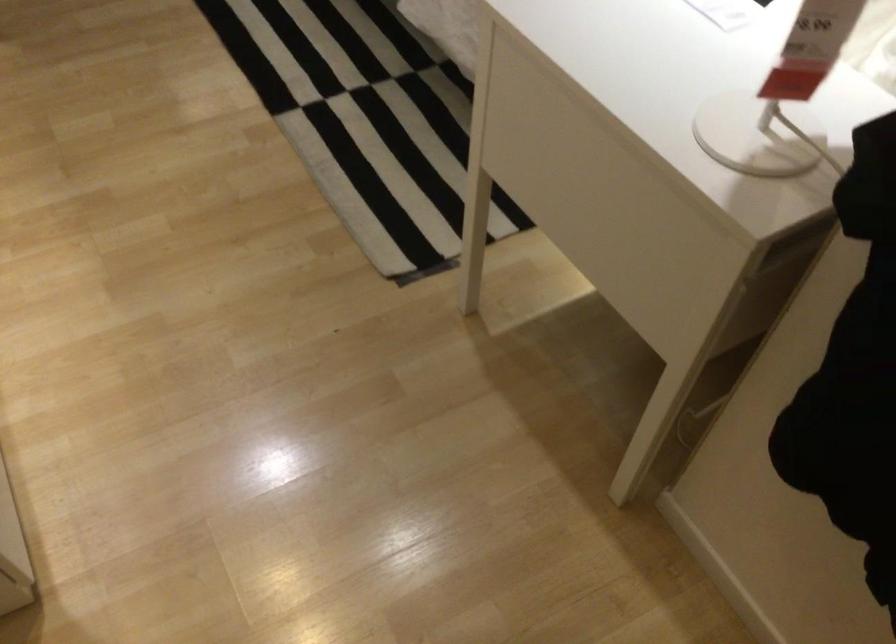
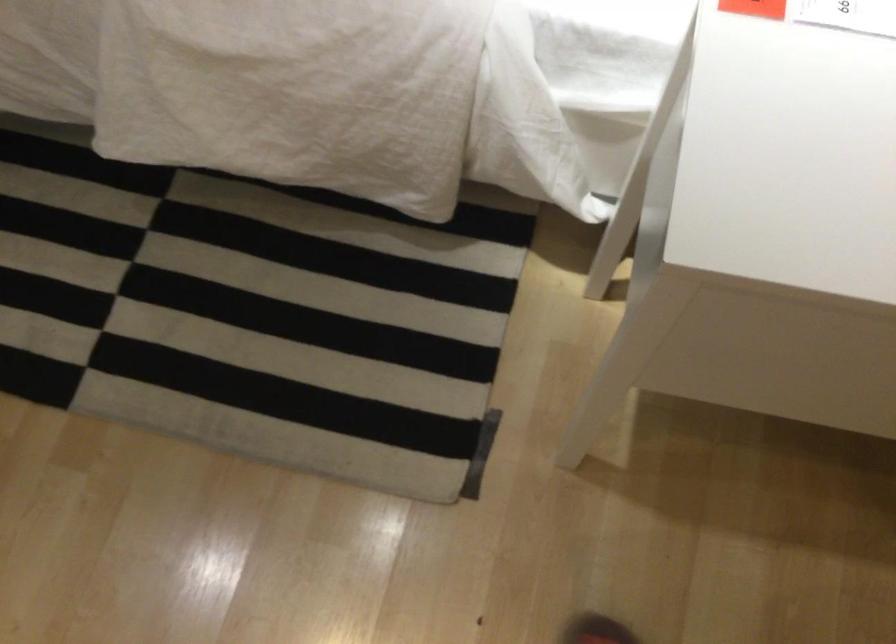
Question: The images are taken continuously from a first-person perspective. In which direction is your viewpoint rotating?

Choices:
 (A) Left
 (B) Right
 (C) Up
 (D) Down

Answer: (D)